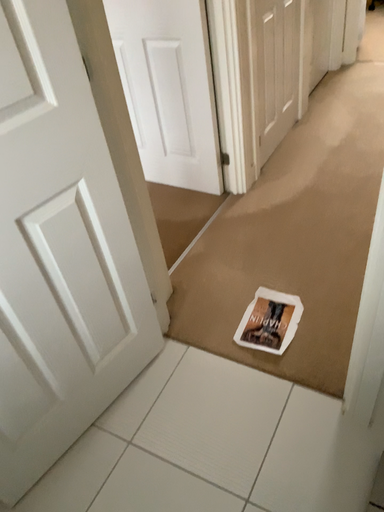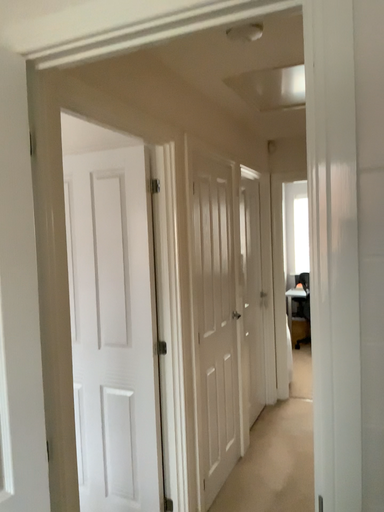
Question: Which way did the camera rotate in the video?

Choices:
 (A) rotated upward
 (B) rotated downward

Answer: (A)